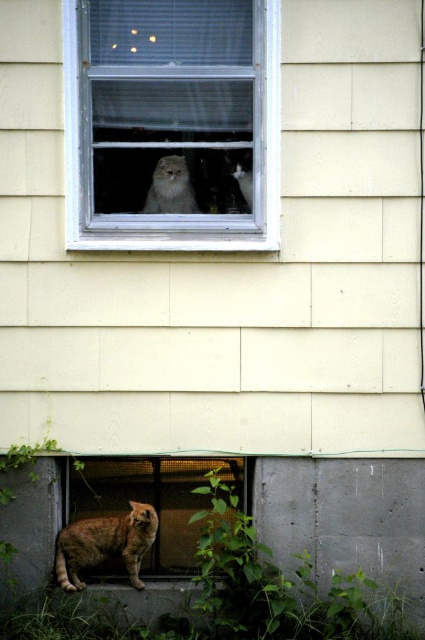
Question: Does translucent mesh door at lower center have a greater width compared to fluffy white cat at upper center?

Choices:
 (A) yes
 (B) no

Answer: (A)

Question: Which object is the closest to the white plastic window at upper center?

Choices:
 (A) translucent mesh door at lower center
 (B) tabby fur cat at lower left

Answer: (A)

Question: Which of these objects is positioned closest to the white plastic window at upper center?

Choices:
 (A) fuzzy gray cat at upper center
 (B) tabby fur cat at lower left
 (C) translucent mesh door at lower center
 (D) fluffy white cat at upper center

Answer: (A)

Question: Can you confirm if fuzzy gray cat at upper center is bigger than fluffy white cat at upper center?

Choices:
 (A) yes
 (B) no

Answer: (A)

Question: Which of these objects is positioned farthest from the fluffy white cat at upper center?

Choices:
 (A) tabby fur cat at lower left
 (B) translucent mesh door at lower center
 (C) fuzzy gray cat at upper center

Answer: (A)

Question: Is translucent mesh door at lower center wider than fuzzy gray cat at upper center?

Choices:
 (A) yes
 (B) no

Answer: (A)